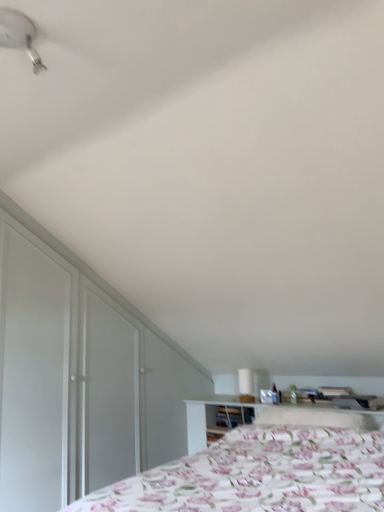
Question: From a real-world perspective, is fluffy white pillow at center located higher than white plastic fan at upper left?

Choices:
 (A) no
 (B) yes

Answer: (A)

Question: From a real-world perspective, is fluffy white pillow at center physically below white plastic fan at upper left?

Choices:
 (A) yes
 (B) no

Answer: (A)

Question: Is fluffy white pillow at center further to the viewer compared to white plastic fan at upper left?

Choices:
 (A) no
 (B) yes

Answer: (B)

Question: Would you say fluffy white pillow at center is outside white plastic fan at upper left?

Choices:
 (A) no
 (B) yes

Answer: (B)

Question: Is fluffy white pillow at center facing away from white plastic fan at upper left?

Choices:
 (A) yes
 (B) no

Answer: (B)

Question: From the image's perspective, is white glossy dresser at left located above or below white glossy table lamp at upper center?

Choices:
 (A) above
 (B) below

Answer: (A)

Question: Which is correct: white glossy dresser at left is inside white glossy table lamp at upper center, or outside of it?

Choices:
 (A) inside
 (B) outside

Answer: (B)

Question: Is white glossy dresser at left in front of or behind white glossy table lamp at upper center in the image?

Choices:
 (A) front
 (B) behind

Answer: (A)

Question: Looking at their shapes, would you say white glossy dresser at left is wider or thinner than white glossy table lamp at upper center?

Choices:
 (A) thin
 (B) wide

Answer: (A)

Question: Based on their positions, is white plastic fan at upper left located to the left or right of fluffy white pillow at center?

Choices:
 (A) left
 (B) right

Answer: (A)

Question: Does point (29, 42) appear closer or farther from the camera than point (278, 420)?

Choices:
 (A) farther
 (B) closer

Answer: (B)

Question: From the image's perspective, is white plastic fan at upper left located above or below fluffy white pillow at center?

Choices:
 (A) below
 (B) above

Answer: (B)

Question: In terms of width, does white plastic fan at upper left look wider or thinner when compared to fluffy white pillow at center?

Choices:
 (A) wide
 (B) thin

Answer: (B)

Question: Based on their sizes in the image, would you say white plastic fan at upper left is bigger or smaller than white glossy table lamp at upper center?

Choices:
 (A) big
 (B) small

Answer: (A)

Question: Looking at their shapes, would you say white plastic fan at upper left is wider or thinner than white glossy table lamp at upper center?

Choices:
 (A) thin
 (B) wide

Answer: (B)